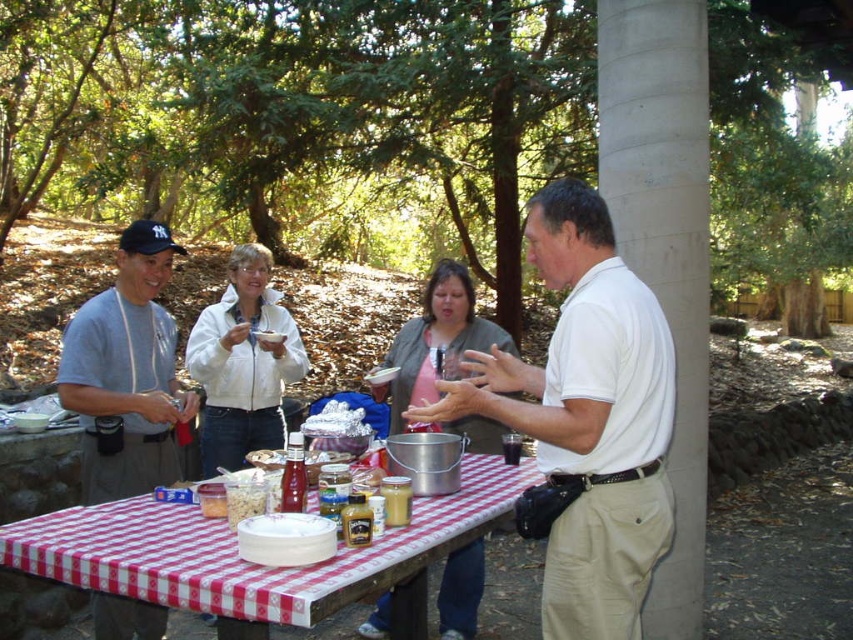
Does white cotton shirt at center have a greater width compared to pink fabric shirt at center?

Yes, white cotton shirt at center is wider than pink fabric shirt at center.

Based on the photo, how much distance is there between white cotton shirt at center and pink fabric shirt at center?

white cotton shirt at center is 34.29 inches from pink fabric shirt at center.

Is point (616, 260) closer to camera compared to point (433, 276)?

Yes, point (616, 260) is closer to viewer.

Where is `white cotton shirt at center`? Image resolution: width=853 pixels, height=640 pixels. white cotton shirt at center is located at coordinates (587, 417).

Which is in front, point (100, 582) or point (215, 349)?

Point (100, 582) is more forward.

Between point (416, 550) and point (196, 380), which one is positioned behind?

Point (196, 380)

Where is `checkered fabric table at center`? Image resolution: width=853 pixels, height=640 pixels. checkered fabric table at center is located at coordinates (252, 563).

Can you confirm if white matte jacket at center is shorter than pink fabric shirt at center?

No, white matte jacket at center is not shorter than pink fabric shirt at center.

Which is behind, point (248, 280) or point (467, 292)?

The point (248, 280) is more distant.

Where is `white matte jacket at center`? The image size is (853, 640). white matte jacket at center is located at coordinates (242, 364).

I want to click on white matte jacket at center, so click(x=242, y=364).